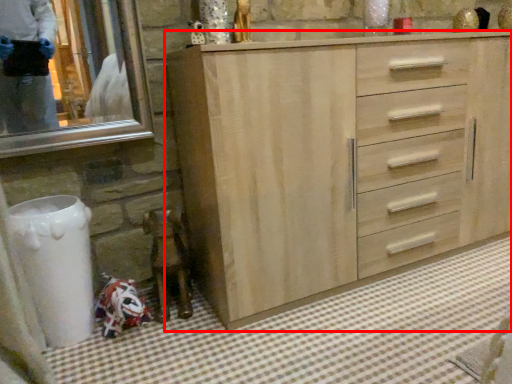
Question: From the image's perspective, where is chest of drawers (annotated by the red box) located in relation to bath mat in the image?

Choices:
 (A) below
 (B) above

Answer: (B)